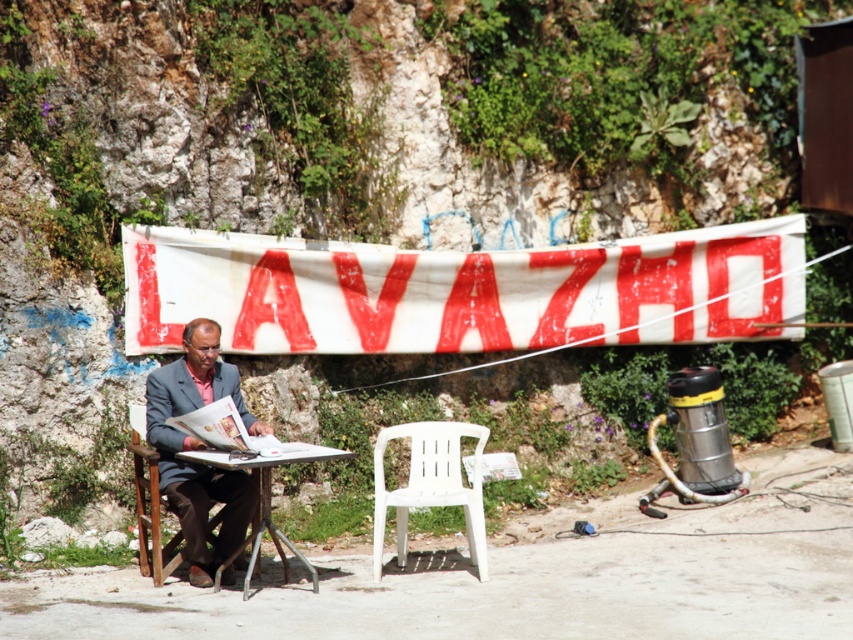
Is white fabric banner at center below white plastic chair at center?

Actually, white fabric banner at center is above white plastic chair at center.

Is point (740, 276) positioned after point (381, 433)?

Yes, it is behind point (381, 433).

Between point (758, 259) and point (393, 500), which one is positioned behind?

Positioned behind is point (758, 259).

Identify the location of white fabric banner at center. (459, 291).

Who is higher up, metallic silver table at center or wooden chair at left?

wooden chair at left is higher up.

Does metallic silver table at center have a lesser height compared to wooden chair at left?

Indeed, metallic silver table at center has a lesser height compared to wooden chair at left.

Locate an element on the screen. metallic silver table at center is located at coordinates (264, 502).

Does point (445, 253) come closer to viewer compared to point (187, 381)?

No, (445, 253) is further to viewer.

Which of these two, white fabric banner at center or matte brown suit at center, stands shorter?

white fabric banner at center is shorter.

Who is more distant from viewer, (238, 349) or (199, 328)?

Positioned behind is point (238, 349).

In order to click on white fabric banner at center in this screenshot , I will do `click(459, 291)`.